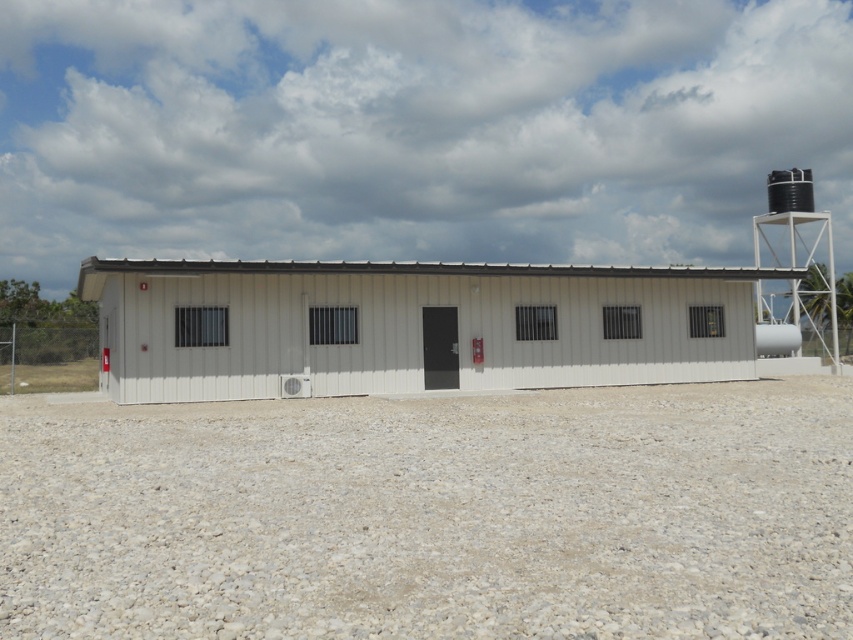
From the picture: You are standing at the point with coordinates (410, 326) in the image. What object are you directly facing?

You are directly facing the white corrugated metal shed at center.

You are a delivery person trying to park your 2.5 meter tall truck near the white corrugated metal shed at center. The truck needs clearance to avoid hitting the black matte water tower at upper right. Is the shed shorter than the tower?

The white corrugated metal shed at center is shorter than the black matte water tower at upper right, so the truck can park near the shed without hitting the tower as long as it stays below the tower.

You are planning to place a new large sculpture in the gray gravel at center. The sculpture requires a base that must be larger than the black matte water tower at upper right. Based on the scene, is this feasible?

The gray gravel at center is smaller than the black matte water tower at upper right, so placing a base larger than the water tower there would not be feasible as the gravel area is insufficient in size.